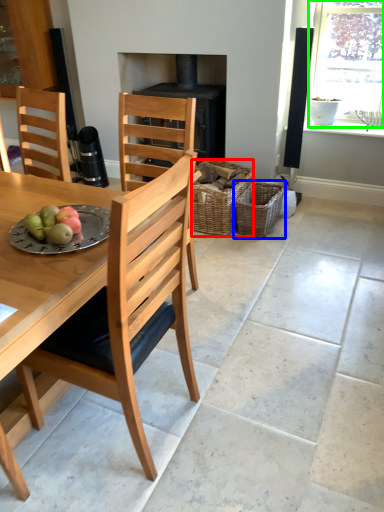
Question: Which object is the closest to the basket (highlighted by a red box)? Choose among these: basket (highlighted by a blue box) or window (highlighted by a green box).

Choices:
 (A) basket
 (B) window

Answer: (A)